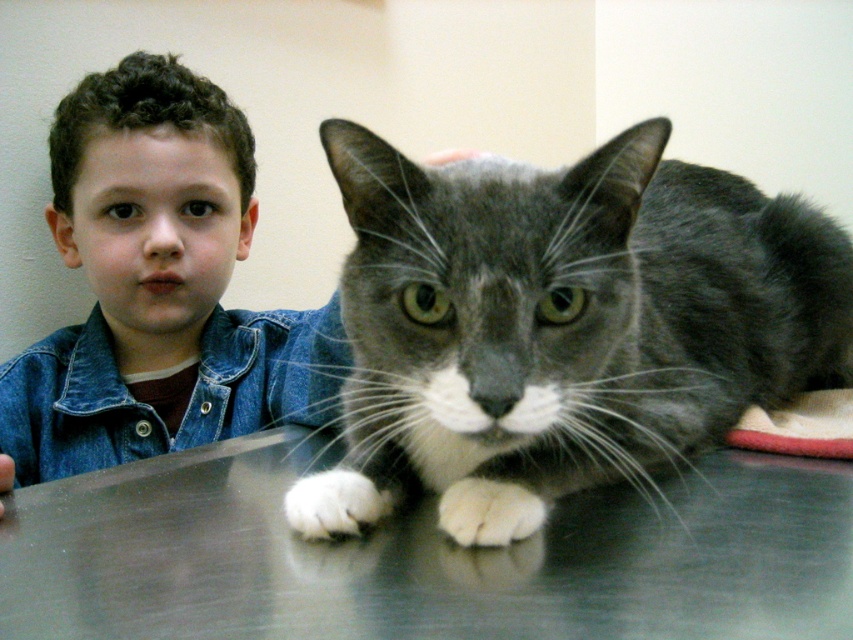
Can you confirm if gray fur cat at center is positioned to the left of denim jacket at left?

Incorrect, gray fur cat at center is not on the left side of denim jacket at left.

What do you see at coordinates (572, 310) in the screenshot? This screenshot has width=853, height=640. I see `gray fur cat at center` at bounding box center [572, 310].

This screenshot has height=640, width=853. In order to click on gray fur cat at center in this screenshot , I will do `click(572, 310)`.

You are a GUI agent. You are given a task and a screenshot of the screen. Output one action in this format:
    pyautogui.click(x=<x>, y=<y>)
    Task: Click on the gray fur cat at center
    
    Given the screenshot: What is the action you would take?
    pyautogui.click(x=572, y=310)

Who is more forward, (x=117, y=145) or (x=25, y=381)?

Positioned in front is point (x=25, y=381).

Image resolution: width=853 pixels, height=640 pixels. In order to click on denim jacket at left in this screenshot , I will do `click(157, 288)`.

What do you see at coordinates (157, 288) in the screenshot?
I see `denim jacket at left` at bounding box center [157, 288].

Where is `denim jacket at left`? denim jacket at left is located at coordinates (157, 288).

Who is more forward, (254, 595) or (329, 356)?

Point (254, 595)

Does metallic gray table at center appear under brushed denim jacket at lower left?

Yes, metallic gray table at center is below brushed denim jacket at lower left.

At what (x,y) coordinates should I click in order to perform the action: click on metallic gray table at center. Please return your answer as a coordinate pair (x, y). Image resolution: width=853 pixels, height=640 pixels. Looking at the image, I should click on (424, 556).